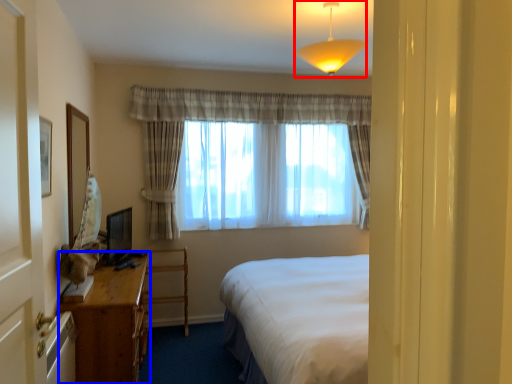
Question: Which object is closer to the camera taking this photo, lamp (highlighted by a red box) or desk (highlighted by a blue box)?

Choices:
 (A) lamp
 (B) desk

Answer: (A)